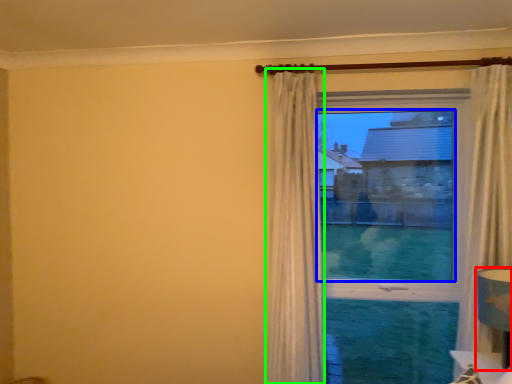
Question: Which is farther away from table lamp (highlighted by a red box)? window screen (highlighted by a blue box) or curtain (highlighted by a green box)?

Choices:
 (A) window screen
 (B) curtain

Answer: (B)